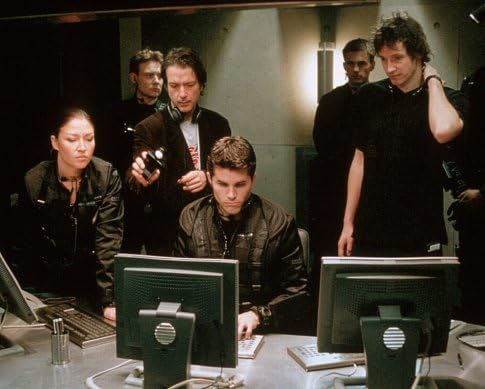
Where is `metallic pen holder`? Image resolution: width=485 pixels, height=389 pixels. metallic pen holder is located at coordinates (59, 344).